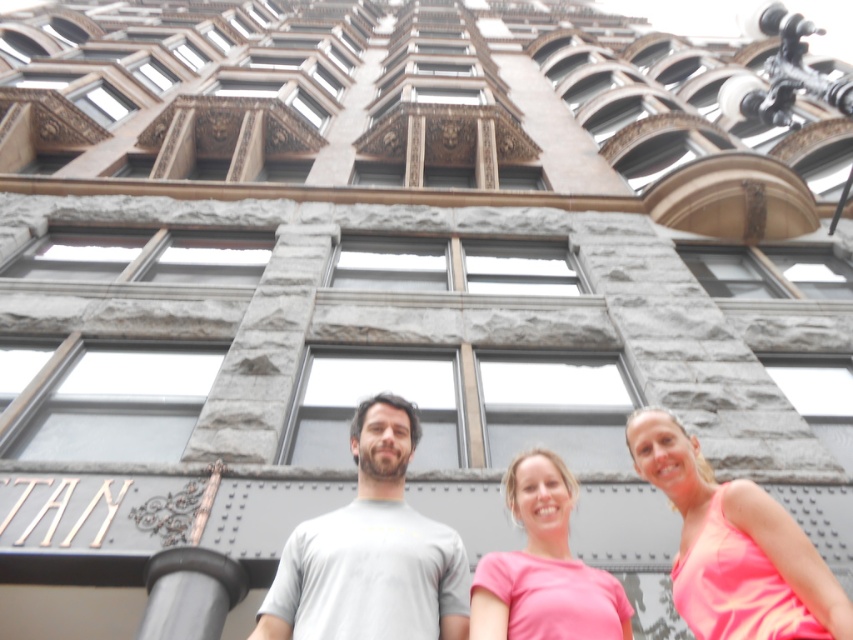
Is point (374, 452) closer to camera compared to point (619, 630)?

No, it is not.

Does point (374, 481) lie behind point (494, 616)?

Yes, point (374, 481) is farther from viewer.

Identify the location of gray matte t-shirt at center. click(370, 552).

Is pink fabric at center in front of black rubber pole at lower center?

Yes, pink fabric at center is in front of black rubber pole at lower center.

Between point (679, 429) and point (160, 588), which one is positioned behind?

The point (679, 429) is behind.

In order to click on pink fabric at center in this screenshot , I will do `click(734, 541)`.

Is pink fabric at center wider than pink matte shirt at center?

No.

Does pink fabric at center have a greater height compared to pink matte shirt at center?

Indeed, pink fabric at center has a greater height compared to pink matte shirt at center.

The height and width of the screenshot is (640, 853). Find the location of `pink fabric at center`. pink fabric at center is located at coordinates (734, 541).